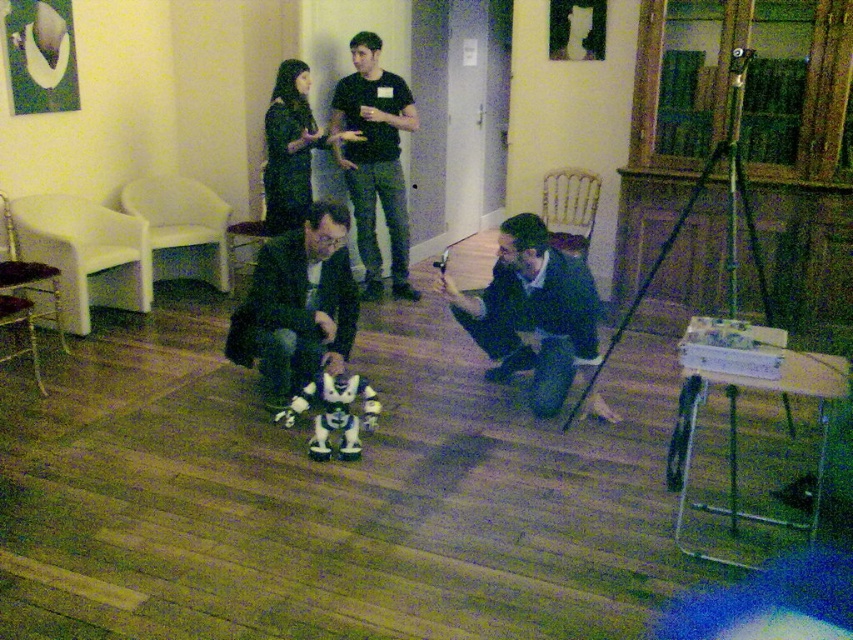
In the scene shown: Does matte black suit at center have a greater width compared to black matte shirt at upper center?

Correct, the width of matte black suit at center exceeds that of black matte shirt at upper center.

Who is more forward, (239, 349) or (396, 214)?

Point (239, 349) is in front.

Where is `matte black suit at center`? matte black suit at center is located at coordinates (297, 305).

Looking at this image, does black matte shirt at upper center have a lesser width compared to dark green fabric dress at upper center?

Incorrect, black matte shirt at upper center's width is not less than dark green fabric dress at upper center's.

Does point (404, 93) lie in front of point (288, 221)?

No, (404, 93) is further to viewer.

Where is `black matte shirt at upper center`? This screenshot has height=640, width=853. black matte shirt at upper center is located at coordinates (374, 160).

Is dark blue sweater at lower center below black matte shirt at upper center?

Yes, dark blue sweater at lower center is below black matte shirt at upper center.

In the scene shown: Does dark blue sweater at lower center have a lesser width compared to black matte shirt at upper center?

Incorrect, dark blue sweater at lower center's width is not less than black matte shirt at upper center's.

Locate an element on the screen. This screenshot has width=853, height=640. dark blue sweater at lower center is located at coordinates (531, 301).